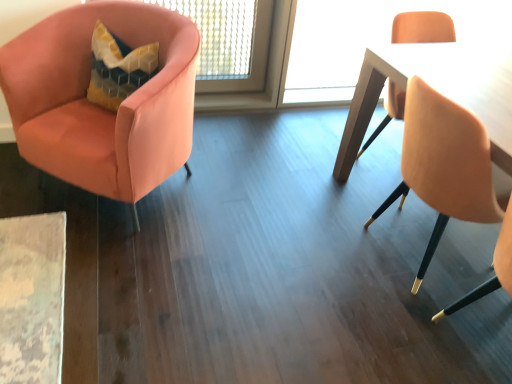
Question: Does wooden table at right have a lesser height compared to satin pink armchair at left, which is the first chair in left-to-right order?

Choices:
 (A) yes
 (B) no

Answer: (B)

Question: Could you tell me if wooden table at right is facing satin pink armchair at left, which is the first chair in left-to-right order?

Choices:
 (A) no
 (B) yes

Answer: (A)

Question: Considering the relative sizes of wooden table at right and satin pink armchair at left, which is the first chair in left-to-right order, in the image provided, is wooden table at right smaller than satin pink armchair at left, which is the first chair in left-to-right order,?

Choices:
 (A) no
 (B) yes

Answer: (B)

Question: Is satin pink armchair at left, acting as the 2th chair starting from the right, surrounded by wooden table at right?

Choices:
 (A) yes
 (B) no

Answer: (B)

Question: Does wooden table at right lie in front of satin pink armchair at left, acting as the 2th chair starting from the right?

Choices:
 (A) yes
 (B) no

Answer: (B)

Question: Considering the relative sizes of wooden table at right and satin pink armchair at left, which is the first chair in left-to-right order, in the image provided, is wooden table at right bigger than satin pink armchair at left, which is the first chair in left-to-right order,?

Choices:
 (A) no
 (B) yes

Answer: (A)

Question: Does matte gold chair at right, which appears as the second chair when viewed from the left, have a greater width compared to wooden table at right?

Choices:
 (A) yes
 (B) no

Answer: (B)

Question: Is matte gold chair at right, which appears as the second chair when viewed from the left, facing away from wooden table at right?

Choices:
 (A) no
 (B) yes

Answer: (A)

Question: Considering the relative sizes of matte gold chair at right, the first chair when ordered from right to left, and wooden table at right in the image provided, is matte gold chair at right, the first chair when ordered from right to left, shorter than wooden table at right?

Choices:
 (A) no
 (B) yes

Answer: (B)

Question: Considering the relative sizes of matte gold chair at right, which appears as the second chair when viewed from the left, and wooden table at right in the image provided, is matte gold chair at right, which appears as the second chair when viewed from the left, smaller than wooden table at right?

Choices:
 (A) no
 (B) yes

Answer: (B)

Question: Considering the relative positions of matte gold chair at right, the first chair when ordered from right to left, and wooden table at right in the image provided, is matte gold chair at right, the first chair when ordered from right to left, to the right of wooden table at right from the viewer's perspective?

Choices:
 (A) no
 (B) yes

Answer: (A)

Question: Can you confirm if matte gold chair at right, which appears as the second chair when viewed from the left, is bigger than wooden table at right?

Choices:
 (A) no
 (B) yes

Answer: (A)

Question: Is wooden table at right positioned before matte gold chair at right, which appears as the second chair when viewed from the left?

Choices:
 (A) yes
 (B) no

Answer: (B)